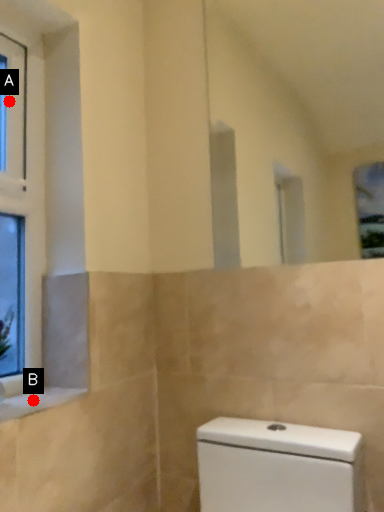
Question: Two points are circled on the image, labeled by A and B beside each circle. Among these points, which one is farthest from the camera?

Choices:
 (A) A is further
 (B) B is further

Answer: (A)